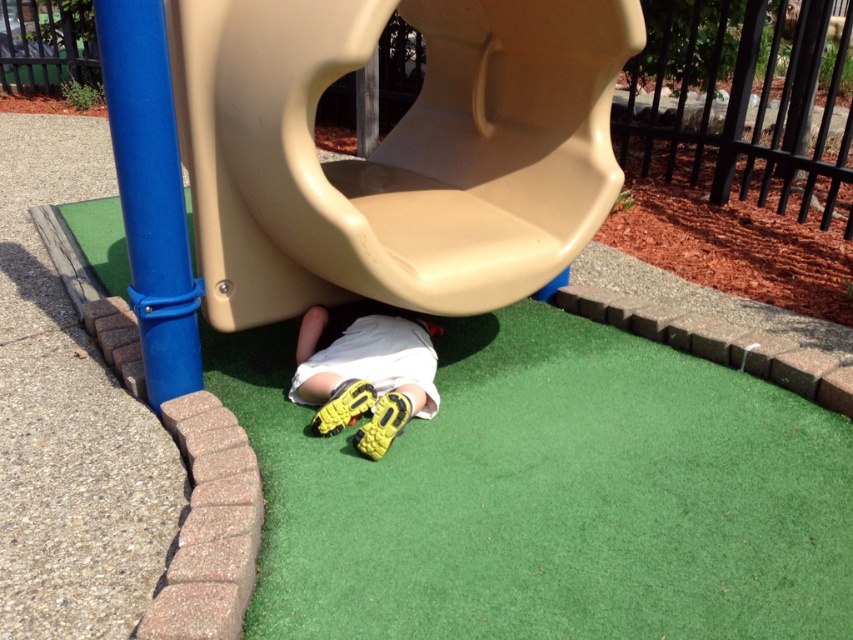
Question: From the image, what is the correct spatial relationship of tan plastic slide at center in relation to yellow rubber shoes at lower center?

Choices:
 (A) below
 (B) above

Answer: (B)

Question: Does green artificial turf at lower center have a smaller size compared to yellow rubber shoes at lower center?

Choices:
 (A) yes
 (B) no

Answer: (B)

Question: Based on their relative distances, which object is farther from the tan plastic slide at center?

Choices:
 (A) green artificial turf at lower center
 (B) yellow rubber shoes at lower center

Answer: (A)

Question: Can you confirm if tan plastic slide at center is wider than yellow rubber shoes at lower center?

Choices:
 (A) yes
 (B) no

Answer: (A)

Question: Which of the following is the closest to the observer?

Choices:
 (A) green artificial turf at lower center
 (B) tan plastic slide at center
 (C) yellow rubber shoes at lower center

Answer: (A)

Question: Which point is closer to the camera?

Choices:
 (A) tan plastic slide at center
 (B) yellow rubber shoes at lower center
 (C) green artificial turf at lower center

Answer: (C)